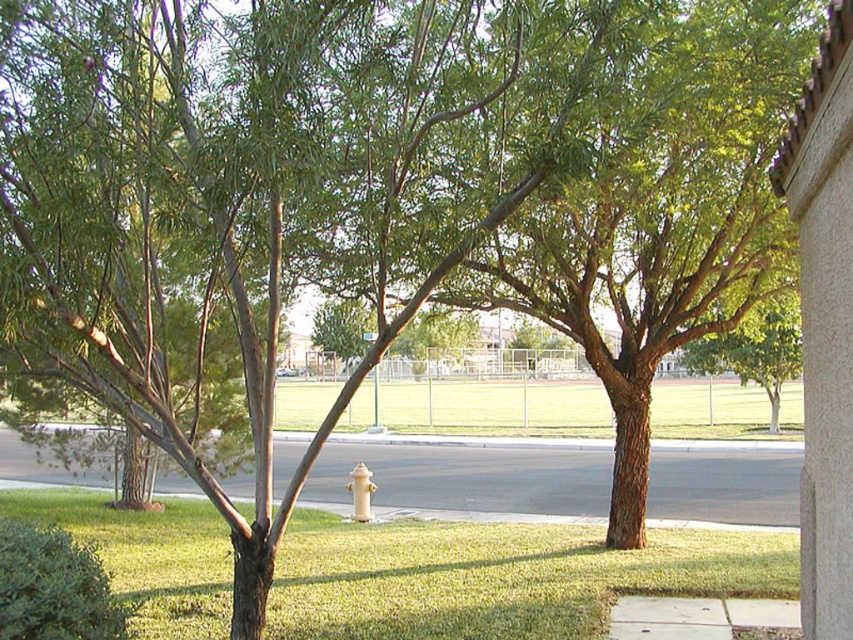
Question: Can you confirm if green grass at lower center is thinner than gray concrete curb at center?

Choices:
 (A) yes
 (B) no

Answer: (A)

Question: Which object appears farthest from the camera in this image?

Choices:
 (A) yellow matte hydrant at center
 (B) green grass at lower center
 (C) white asphalt pavement at center
 (D) gray concrete curb at center

Answer: (D)

Question: Which point is farther to the camera?

Choices:
 (A) yellow matte hydrant at center
 (B) gray concrete curb at center
 (C) green grass at lower center

Answer: (B)

Question: Based on their relative distances, which object is farther from the gray concrete curb at center?

Choices:
 (A) white asphalt pavement at center
 (B) green grass at lower center
 (C) yellow matte hydrant at center

Answer: (B)

Question: Does green grass at lower center appear over white asphalt pavement at center?

Choices:
 (A) yes
 (B) no

Answer: (A)

Question: Does gray concrete curb at center appear under yellow matte hydrant at center?

Choices:
 (A) yes
 (B) no

Answer: (A)